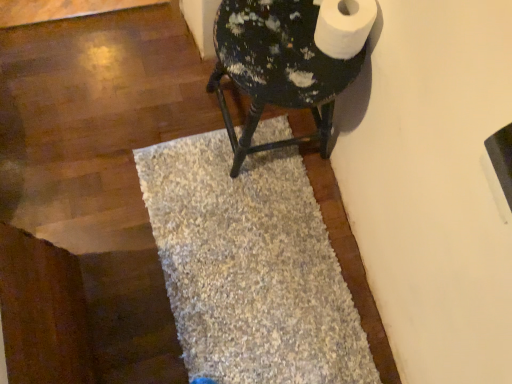
Locate an element on the screen. This screenshot has height=384, width=512. vacant area that lies in front of white matte toilet paper at upper right is located at coordinates (296, 74).